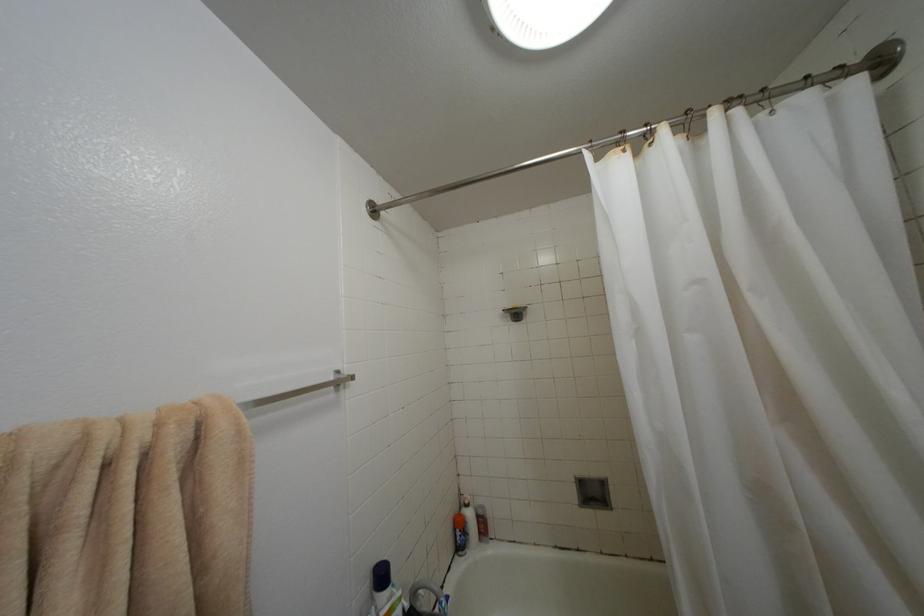
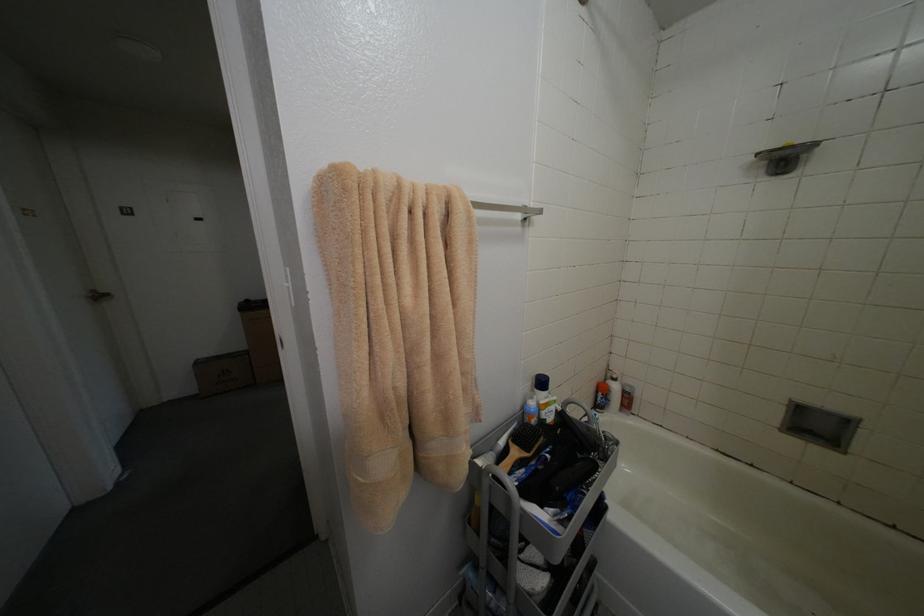
Based on the continuous images, in which direction is the camera rotating?

The camera rotated toward left-down.